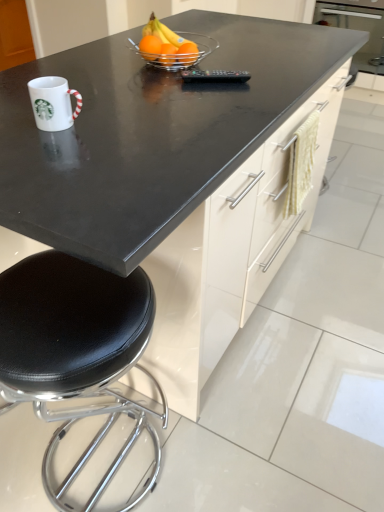
Where is `free space behind white glossy mug at left`? Image resolution: width=384 pixels, height=512 pixels. free space behind white glossy mug at left is located at coordinates (103, 98).